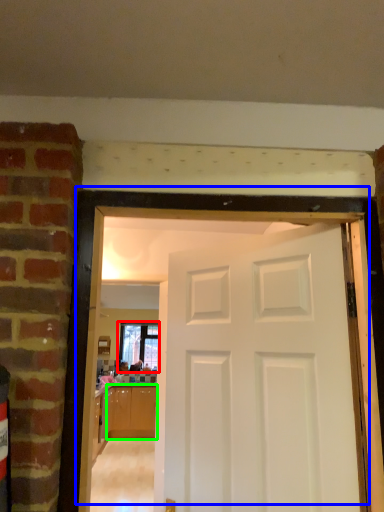
Question: Which object is the closest to the window (highlighted by a red box)? Choose among these: door (highlighted by a blue box) or cabinetry (highlighted by a green box).

Choices:
 (A) door
 (B) cabinetry

Answer: (B)